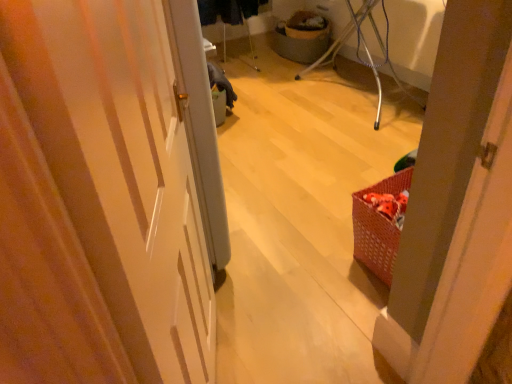
I want to click on white glossy door at center, so click(x=121, y=169).

In order to face white glossy door at center, should I rotate leftwards or rightwards?

Rotate your view left by about 5.880°.

The image size is (512, 384). What do you see at coordinates (121, 169) in the screenshot? I see `white glossy door at center` at bounding box center [121, 169].

This screenshot has height=384, width=512. I want to click on matte gray basket at center, so click(302, 37).

In order to face matte gray basket at center, should I rotate leftwards or rightwards?

Turn right approximately 5.752 degrees to face it.

What do you see at coordinates (302, 37) in the screenshot? I see `matte gray basket at center` at bounding box center [302, 37].

Image resolution: width=512 pixels, height=384 pixels. I want to click on white glossy door at center, so click(x=121, y=169).

Considering the positions of objects white glossy door at center and matte gray basket at center in the image provided, who is more to the left, white glossy door at center or matte gray basket at center?

white glossy door at center is more to the left.

Does white glossy door at center lie behind matte gray basket at center?

No, it is in front of matte gray basket at center.

Does point (153, 243) lie in front of point (285, 52)?

Yes, point (153, 243) is closer to viewer.

From the image's perspective, is white glossy door at center located above or below matte gray basket at center?

From the image's perspective, white glossy door at center appears below matte gray basket at center.

From a real-world perspective, is white glossy door at center located higher than matte gray basket at center?

Indeed, from a real-world perspective, white glossy door at center stands above matte gray basket at center.

Considering the relative sizes of white glossy door at center and matte gray basket at center in the image provided, is white glossy door at center wider than matte gray basket at center?

No, white glossy door at center is not wider than matte gray basket at center.

From the picture: Who is shorter, white glossy door at center or matte gray basket at center?

matte gray basket at center.

Which of these two, white glossy door at center or matte gray basket at center, is smaller?

Smaller between the two is matte gray basket at center.

Is white glossy door at center spatially inside matte gray basket at center, or outside of it?

white glossy door at center is not enclosed by matte gray basket at center.

In the scene shown: Is white glossy door at center positioned far away from matte gray basket at center?

Yes, white glossy door at center and matte gray basket at center are quite far apart.

Could you tell me if white glossy door at center is turned towards matte gray basket at center?

No.

In the image, there is a white glossy door at center. At what (x,y) coordinates should I click in order to perform the action: click on basket below it (from a real-world perspective). Please return your answer as a coordinate pair (x, y). The image size is (512, 384). Looking at the image, I should click on (302, 37).

Which is more to the left, matte gray basket at center or white glossy door at center?

white glossy door at center.

Which is behind, matte gray basket at center or white glossy door at center?

matte gray basket at center.

Between point (297, 34) and point (203, 352), which one is positioned in front?

The point (203, 352) is closer.

From the image's perspective, which is below, matte gray basket at center or white glossy door at center?

white glossy door at center.

From a real-world perspective, which is physically above, matte gray basket at center or white glossy door at center?

white glossy door at center is physically above.

Does matte gray basket at center have a greater width compared to white glossy door at center?

Yes, matte gray basket at center is wider than white glossy door at center.

In terms of height, does matte gray basket at center look taller or shorter compared to white glossy door at center?

Clearly, matte gray basket at center is shorter compared to white glossy door at center.

Does matte gray basket at center have a smaller size compared to white glossy door at center?

Yes.

Is matte gray basket at center positioned beyond the bounds of white glossy door at center?

Yes, matte gray basket at center is outside of white glossy door at center.

In the scene shown: Is there a large distance between matte gray basket at center and white glossy door at center?

matte gray basket at center is positioned a significant distance from white glossy door at center.

Could you tell me if matte gray basket at center is turned towards white glossy door at center?

No.

How many degrees apart are the facing directions of matte gray basket at center and white glossy door at center?

matte gray basket at center and white glossy door at center are facing 137 degrees away from each other.

In order to click on door located in front of the matte gray basket at center in this screenshot , I will do pos(121,169).

At what (x,y) coordinates should I click in order to perform the action: click on door above the matte gray basket at center (from a real-world perspective). Please return your answer as a coordinate pair (x, y). This screenshot has width=512, height=384. Looking at the image, I should click on (121, 169).

You are a GUI agent. You are given a task and a screenshot of the screen. Output one action in this format:
    pyautogui.click(x=<x>, y=<y>)
    Task: Click on the basket above the white glossy door at center (from the image's perspective)
    
    Given the screenshot: What is the action you would take?
    pyautogui.click(x=302, y=37)